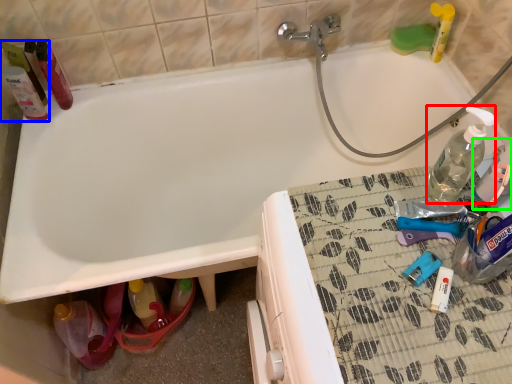
Question: Considering the real-world distances, which object is farthest from bottle (highlighted by a red box)? cleaning product (highlighted by a blue box) or bottle (highlighted by a green box)?

Choices:
 (A) cleaning product
 (B) bottle

Answer: (A)